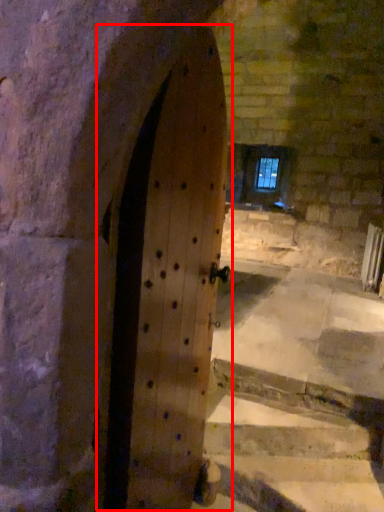
Question: In this image, where is door (annotated by the red box) located relative to window?

Choices:
 (A) right
 (B) left

Answer: (B)